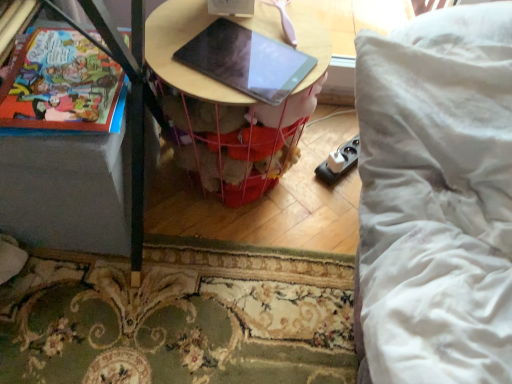
Question: Is wooden table at center in contact with matte black tablet at center?

Choices:
 (A) yes
 (B) no

Answer: (A)

Question: Is wooden table at center shorter than matte black tablet at center?

Choices:
 (A) no
 (B) yes

Answer: (A)

Question: Considering the relative positions of wooden table at center and matte black tablet at center in the image provided, is wooden table at center in front of matte black tablet at center?

Choices:
 (A) yes
 (B) no

Answer: (B)

Question: Does wooden table at center appear on the right side of matte black tablet at center?

Choices:
 (A) yes
 (B) no

Answer: (B)

Question: Does wooden table at center turn towards matte black tablet at center?

Choices:
 (A) yes
 (B) no

Answer: (B)

Question: Looking at their shapes, would you say matte paper comic book at left is wider or thinner than matte black tablet at center?

Choices:
 (A) wide
 (B) thin

Answer: (A)

Question: Is matte paper comic book at left situated inside matte black tablet at center or outside?

Choices:
 (A) inside
 (B) outside

Answer: (B)

Question: Would you say matte paper comic book at left is to the left or to the right of matte black tablet at center in the picture?

Choices:
 (A) right
 (B) left

Answer: (B)

Question: Considering the positions of point (49, 124) and point (247, 67), is point (49, 124) closer or farther from the camera than point (247, 67)?

Choices:
 (A) closer
 (B) farther

Answer: (A)

Question: Considering the positions of matte black tablet at center and matte paper comic book at left in the image, is matte black tablet at center wider or thinner than matte paper comic book at left?

Choices:
 (A) wide
 (B) thin

Answer: (B)

Question: Based on their positions, is matte black tablet at center located to the left or right of matte paper comic book at left?

Choices:
 (A) left
 (B) right

Answer: (B)

Question: Is matte black tablet at center spatially inside matte paper comic book at left, or outside of it?

Choices:
 (A) outside
 (B) inside

Answer: (A)

Question: Relative to matte paper comic book at left, is matte black tablet at center in front or behind?

Choices:
 (A) behind
 (B) front

Answer: (A)

Question: From their relative heights in the image, would you say wooden table at center is taller or shorter than matte paper comic book at left?

Choices:
 (A) tall
 (B) short

Answer: (A)

Question: Is wooden table at center inside or outside of matte paper comic book at left?

Choices:
 (A) outside
 (B) inside

Answer: (A)